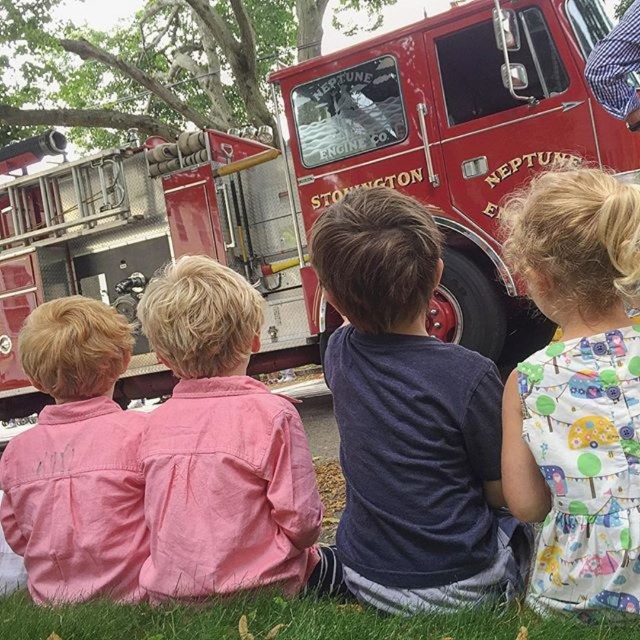
Question: From the image, what is the correct spatial relationship of printed cotton dress at center in relation to pink cotton shirt at left?

Choices:
 (A) right
 (B) left

Answer: (A)

Question: Can you confirm if dark blue shirt at center is bigger than green grass at lower center?

Choices:
 (A) yes
 (B) no

Answer: (B)

Question: Among these points, which one is farthest from the camera?

Choices:
 (A) (49, 612)
 (B) (404, 145)
 (C) (429, 600)
 (D) (196, 417)

Answer: (B)

Question: Is shiny red fire truck at center further to the viewer compared to dark blue shirt at center?

Choices:
 (A) no
 (B) yes

Answer: (B)

Question: Which point is farther to the camera?

Choices:
 (A) green grass at lower center
 (B) dark blue shirt at center
 (C) shiny red fire truck at center
 (D) pink cotton shirt at left

Answer: (C)

Question: Which object is farther from the camera taking this photo?

Choices:
 (A) pink cotton shirt at left
 (B) shiny red fire truck at center
 (C) dark blue shirt at center
 (D) printed cotton dress at center

Answer: (B)